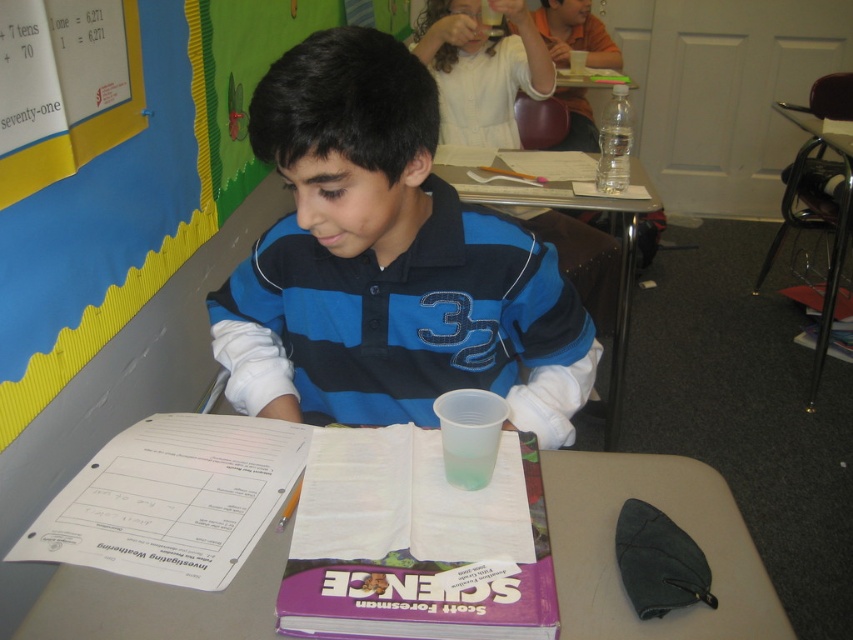
Question: Can you confirm if purple matte book at center is wider than translucent plastic cup at center?

Choices:
 (A) yes
 (B) no

Answer: (B)

Question: Which object is positioned farthest from the blue striped polo shirt at center?

Choices:
 (A) translucent plastic cup at center
 (B) clear plastic cup at upper center

Answer: (B)

Question: Is yellow paper at upper left further to the viewer compared to purple matte book at center?

Choices:
 (A) no
 (B) yes

Answer: (B)

Question: Which of the following is the farthest from the observer?

Choices:
 (A) (548, 189)
 (B) (50, 236)
 (C) (577, 561)
 (D) (328, 525)

Answer: (A)

Question: Which point appears farthest from the camera in this image?

Choices:
 (A) (236, 170)
 (B) (402, 502)
 (C) (560, 506)

Answer: (A)

Question: Does purple matte book at center have a greater width compared to clear plastic cup at upper center?

Choices:
 (A) no
 (B) yes

Answer: (A)